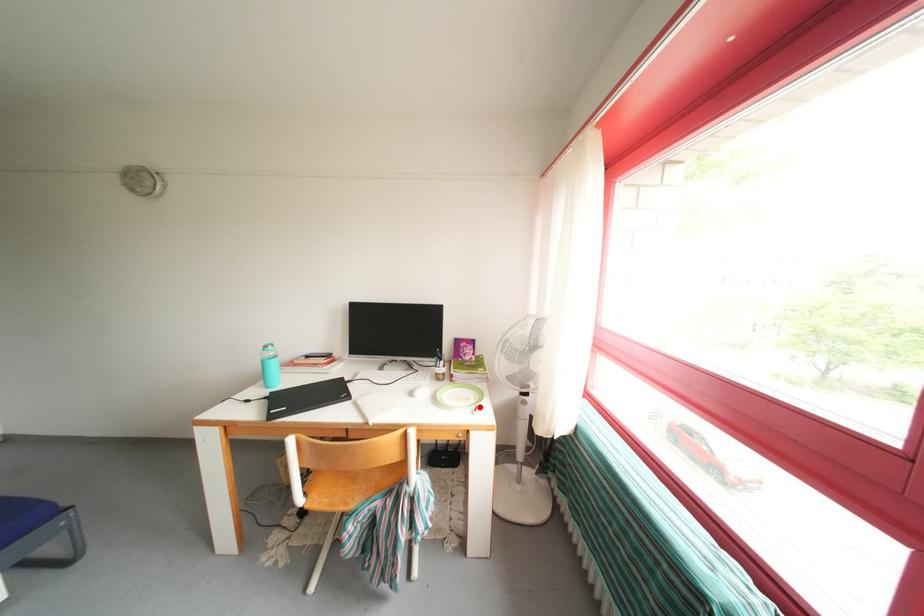
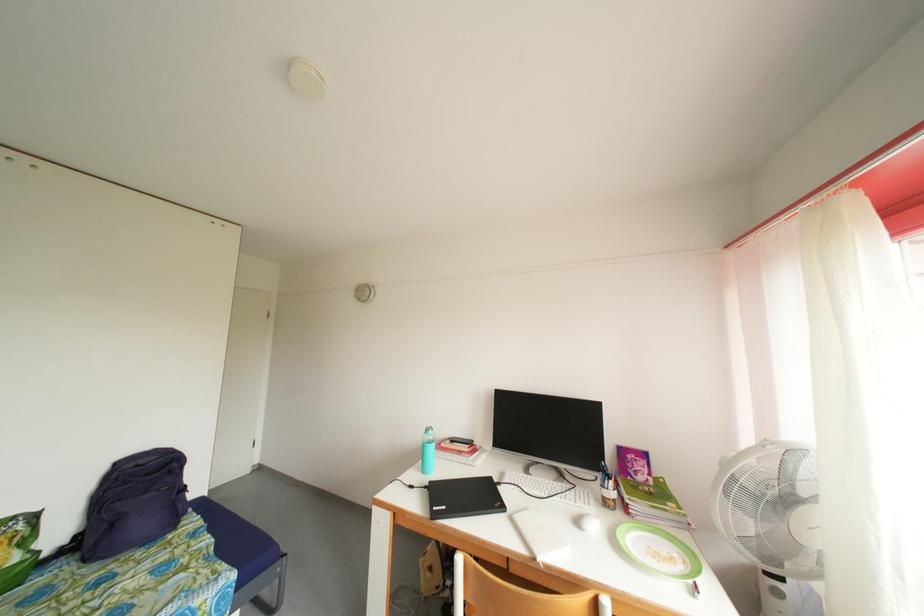
Find the pixel in the second image that matches the highlighted location in the first image.

(688, 573)